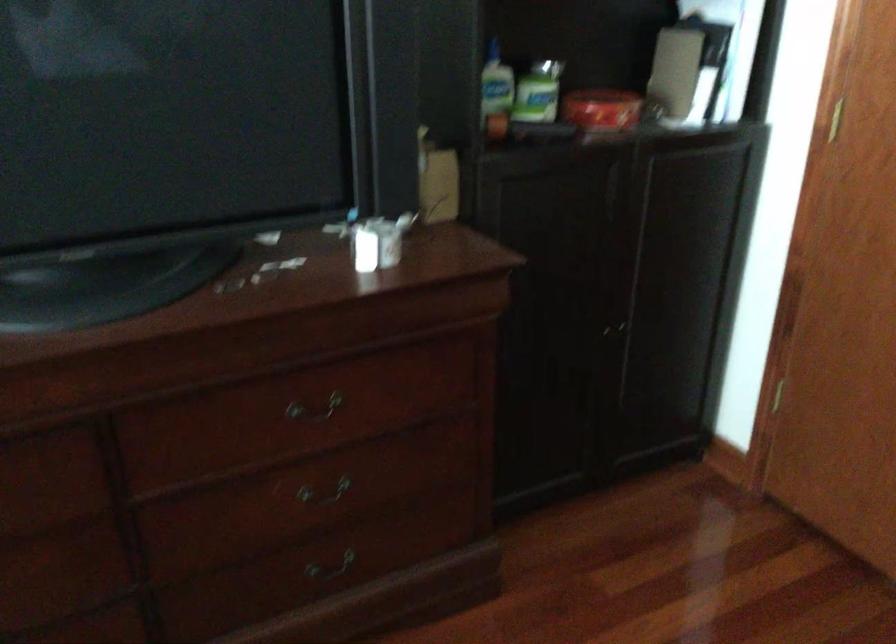
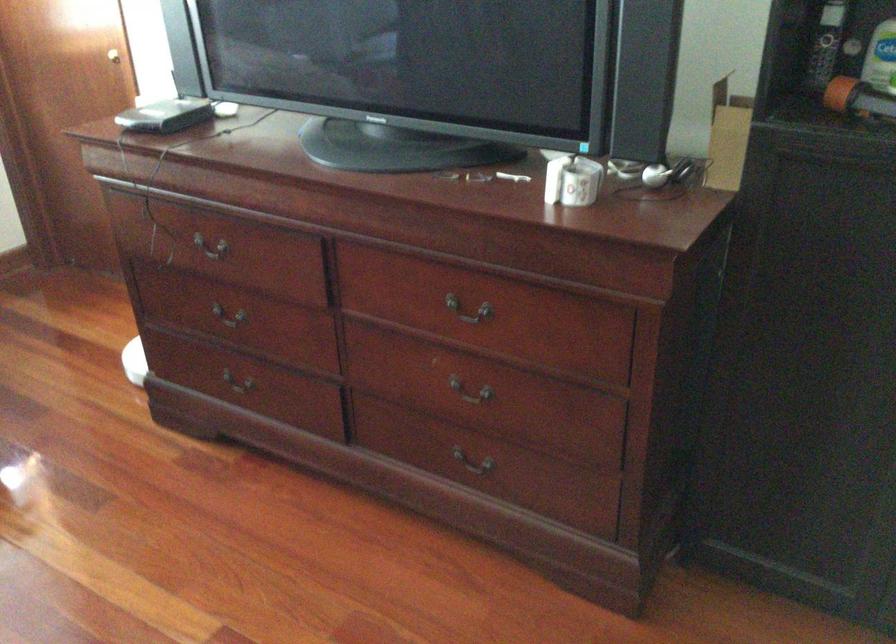
Find the pixel in the second image that matches the point at 366,243 in the first image.

(572, 180)